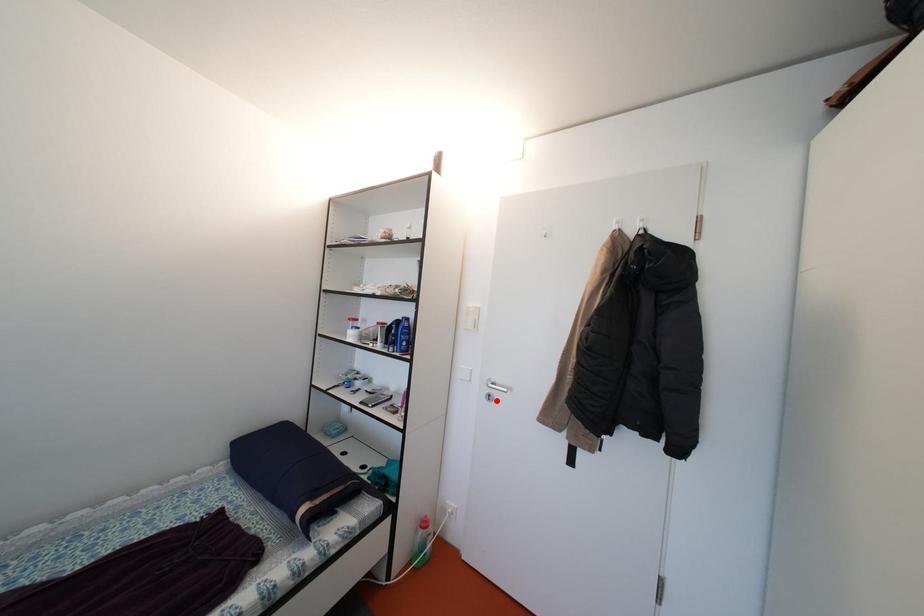
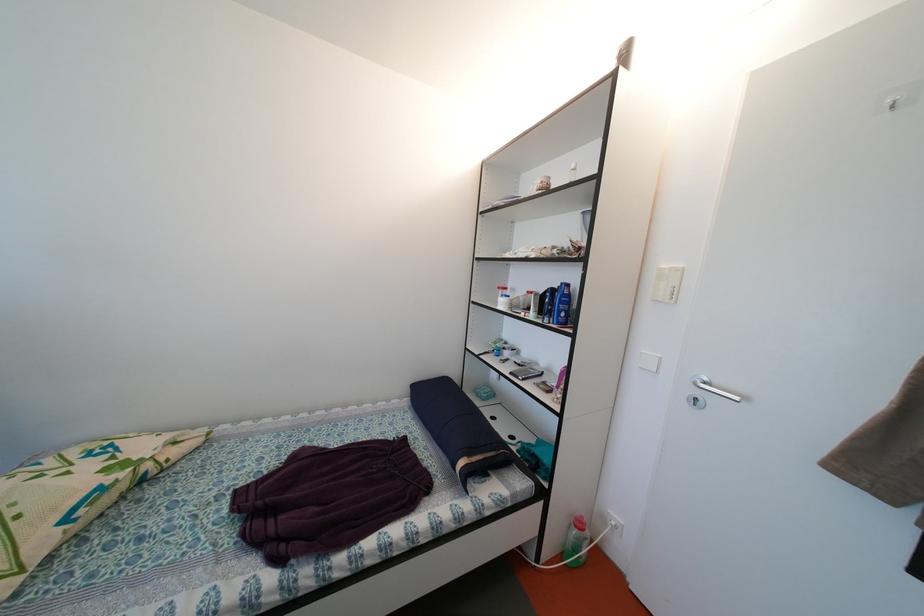
Where in the second image is the point corresponding to the highlighted location from the first image?

(703, 405)